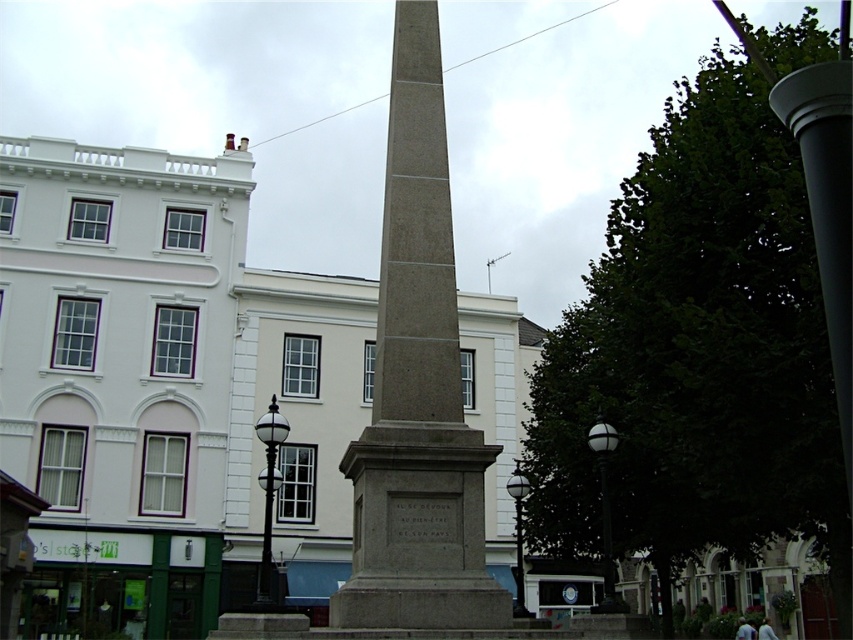
Question: Does black polished lamp post at center have a lesser width compared to white glass lamp post at right?

Choices:
 (A) yes
 (B) no

Answer: (A)

Question: Considering the real-world distances, which object is closest to the white glass lamp post at center?

Choices:
 (A) white glass lamp post at right
 (B) black polished lamp post at center
 (C) gray stone obelisk at center

Answer: (A)

Question: Estimate the real-world distances between objects in this image. Which object is farther from the black polished lamp post at center?

Choices:
 (A) white glass lamp post at center
 (B) white glass lamp post at right
 (C) gray stone obelisk at center

Answer: (B)

Question: Which point is closer to the camera?

Choices:
 (A) (515, 552)
 (B) (259, 483)

Answer: (B)

Question: In this image, where is gray stone obelisk at center located relative to white glass lamp post at center?

Choices:
 (A) left
 (B) right

Answer: (A)

Question: Does gray stone obelisk at center appear on the right side of white glass lamp post at center?

Choices:
 (A) yes
 (B) no

Answer: (B)